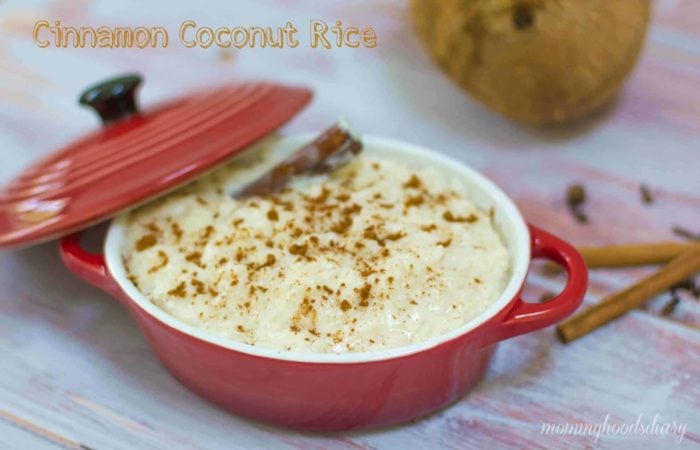
Locate an element on the screen. The image size is (700, 450). table is located at coordinates (64, 370).